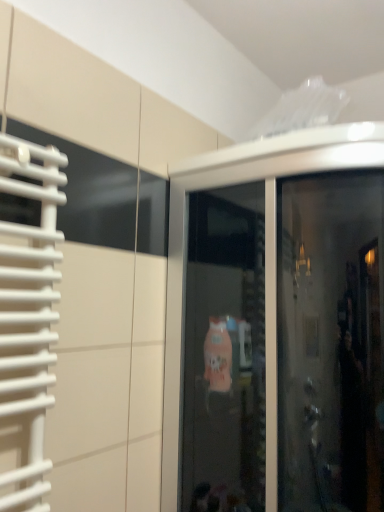
Question: In which direction should I rotate to look at transparent glass screen door at upper center?

Choices:
 (A) left
 (B) right

Answer: (B)